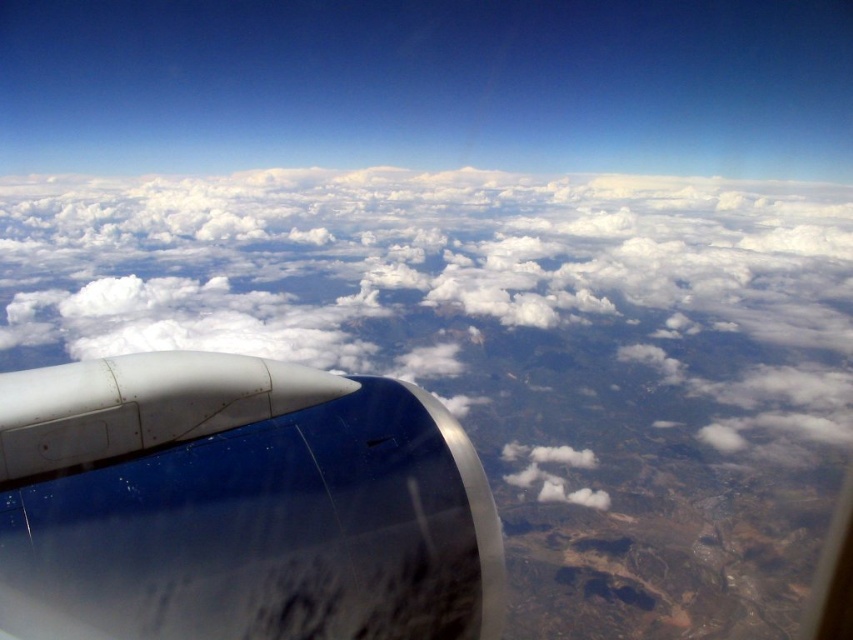
Is white fluffy cloud at center to the right of metallic blue engine at center from the viewer's perspective?

No, white fluffy cloud at center is not to the right of metallic blue engine at center.

Does white fluffy cloud at center have a larger size compared to metallic blue engine at center?

Indeed, white fluffy cloud at center has a larger size compared to metallic blue engine at center.

Measure the distance between point (x=279, y=193) and camera.

Point (x=279, y=193) is 2173.00 feet from camera.

The height and width of the screenshot is (640, 853). Find the location of `white fluffy cloud at center`. white fluffy cloud at center is located at coordinates (480, 307).